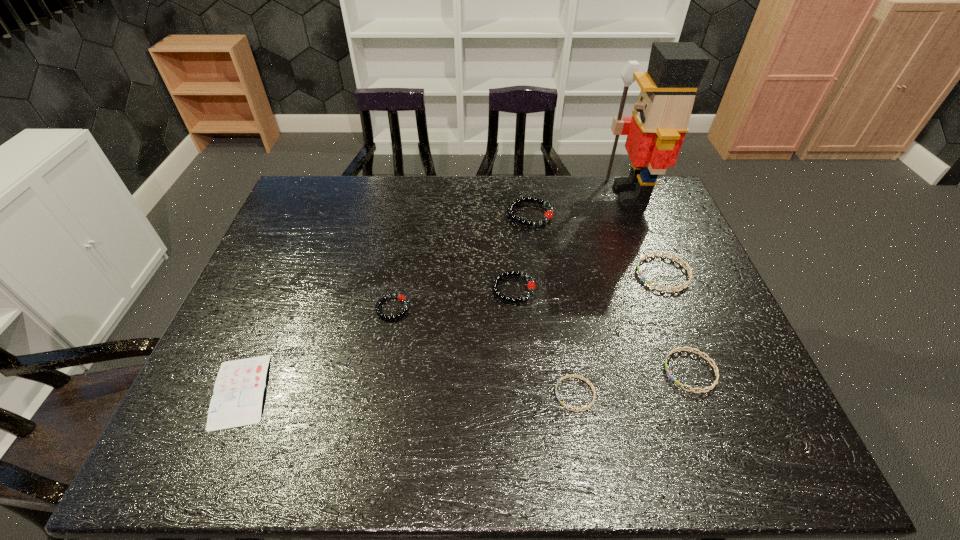
The image size is (960, 540). Identify the location of free point between the leftmost bracelet and the seventh tallest object. (484, 351).

Locate an element on the screen. The image size is (960, 540). vacant point located between the leftmost object and the red nutcracker is located at coordinates (436, 293).

Select which object is the second closest to the tallest object. Please provide its 2D coordinates. Your answer should be formatted as a tuple, i.e. [(x, y)], where the tuple contains the x and y coordinates of a point satisfying the conditions above.

[(682, 262)]

At what (x,y) coordinates should I click in order to perform the action: click on the third closest object to the second biggest blue bracelet. Please return your answer as a coordinate pair (x, y). The height and width of the screenshot is (540, 960). Looking at the image, I should click on (531, 286).

The image size is (960, 540). What are the coordinates of `the second closest bracelet to the red nutcracker` in the screenshot? It's located at (682, 262).

At what (x,y) coordinates should I click in order to perform the action: click on bracelet that is the second closest to the shortest bracelet. Please return your answer as a coordinate pair (x, y). The image size is (960, 540). Looking at the image, I should click on (531, 286).

Choose which black bracelet is the nearest neighbor to the second smallest black bracelet. Please provide its 2D coordinates. Your answer should be formatted as a tuple, i.e. [(x, y)], where the tuple contains the x and y coordinates of a point satisfying the conditions above.

[(548, 215)]

Locate which black bracelet is the closest to the tallest bracelet. Please provide its 2D coordinates. Your answer should be formatted as a tuple, i.e. [(x, y)], where the tuple contains the x and y coordinates of a point satisfying the conditions above.

[(531, 286)]

Locate an element on the screen. Image resolution: width=960 pixels, height=540 pixels. blue bracelet that stands as the closest to the second smallest black bracelet is located at coordinates (576, 376).

Identify which blue bracelet is the third closest to the red nutcracker. Please provide its 2D coordinates. Your answer should be formatted as a tuple, i.e. [(x, y)], where the tuple contains the x and y coordinates of a point satisfying the conditions above.

[(576, 376)]